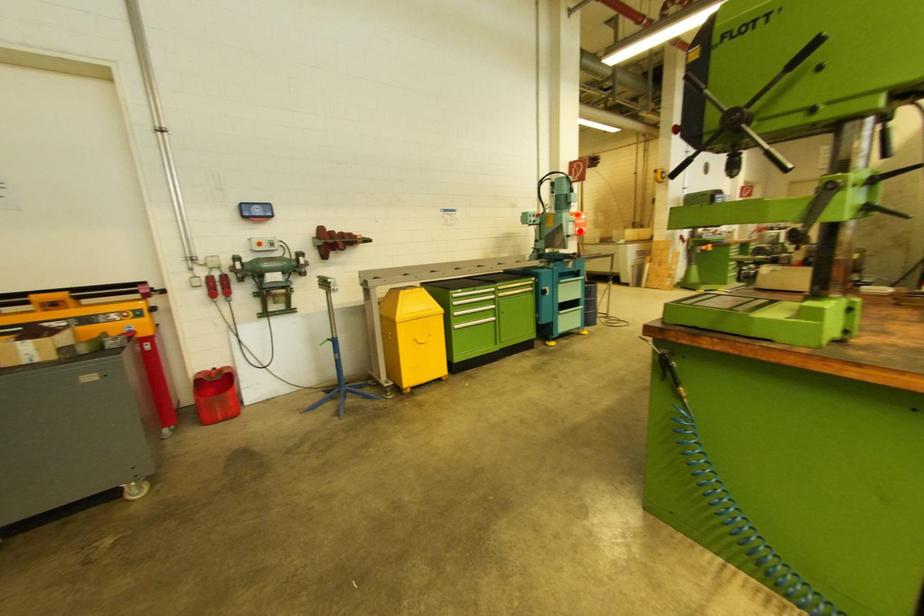
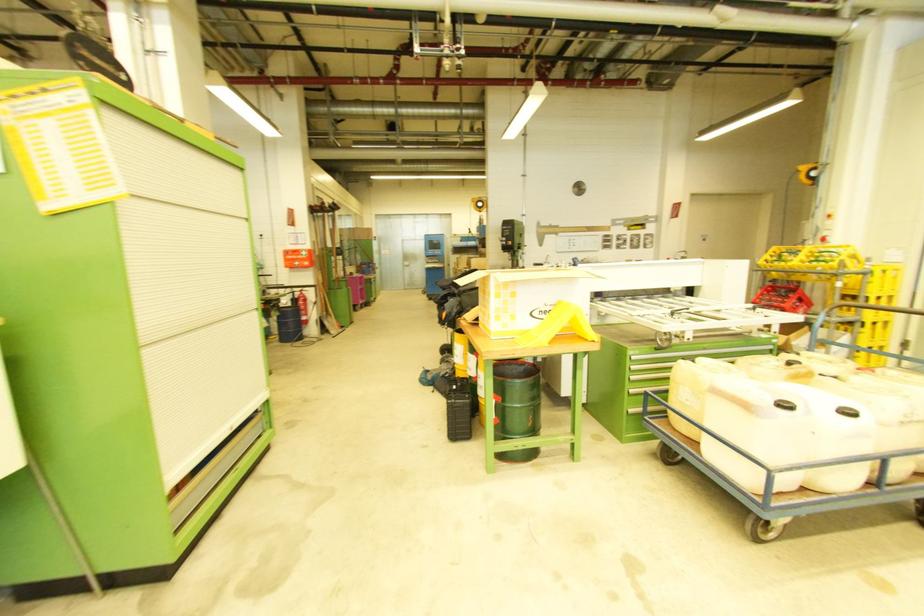
Locate, in the second image, the point that corresponds to the highlighted location in the first image.

(299, 265)